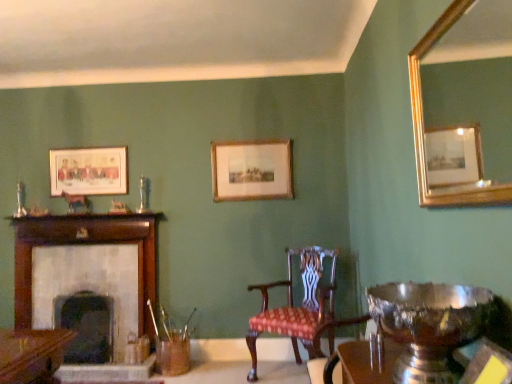
Question: Would you say gold-framed picture at center, acting as the 1th picture frame starting from the front, is inside or outside gold-framed mirror at upper right?

Choices:
 (A) inside
 (B) outside

Answer: (B)

Question: From a real-world perspective, is gold-framed picture at center, acting as the 1th picture frame starting from the front, physically located above or below gold-framed mirror at upper right?

Choices:
 (A) above
 (B) below

Answer: (A)

Question: Estimate the real-world distances between objects in this image. Which object is closer to the dark gray stone fireplace at left, the 1th fireplace in the right-to-left sequence?

Choices:
 (A) white stone fireplace at left, the second fireplace viewed from the right
 (B) gold-framed picture at center, which is the 2th picture frame in left-to-right order
 (C) gold-framed mirror at upper right
 (D) mahogany wood chair at center
 (E) matte wooden picture frame at upper left, the 2th picture frame from the right

Answer: (A)

Question: Which object is the farthest from the mahogany wood chair at center?

Choices:
 (A) dark gray stone fireplace at left, the 1th fireplace in the right-to-left sequence
 (B) matte wooden picture frame at upper left, the 2th picture frame from the right
 (C) white stone fireplace at left, the second fireplace viewed from the right
 (D) gold-framed mirror at upper right
 (E) gold-framed picture at center, which is the 2th picture frame in left-to-right order

Answer: (B)